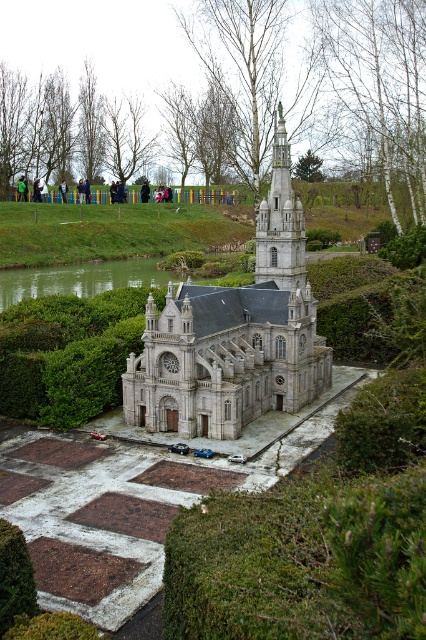
You are a photographer planning to take a picture of the white stone tower at upper center and the green smooth water at center. Which object will appear larger in the photo due to its height?

The white stone tower at upper center will appear larger in the photo because it is much taller than the green smooth water at center.

You are designing a miniature garden and want to place both the green grass at center and the stone church at center. Given their sizes, which one should you allocate more space for?

The green grass at center has a larger width than the stone church at center, so you should allocate more space for the green grass at center.

You are a landscape architect designing a garden for a new Gothic church. In the miniature model you are examining, there is green grass at center and a stone church at center. Which of these two elements occupies a larger area in the model?

The green grass at center is bigger than the stone church at center, so the grass occupies a larger area in the model.